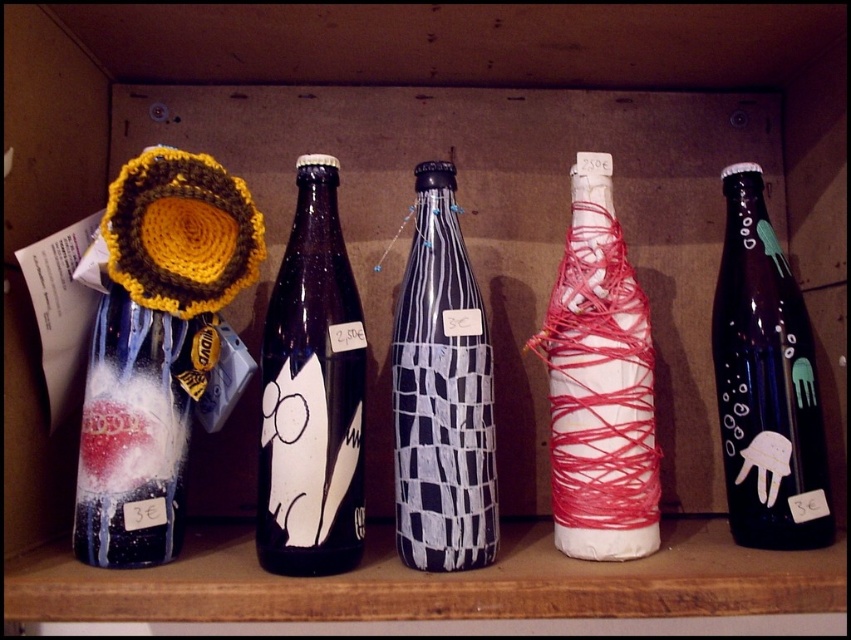
Consider the image. Is matte black bottle at center taller than matte black bottle at right?

Indeed, matte black bottle at center has a greater height compared to matte black bottle at right.

Does point (311, 198) lie behind point (780, 426)?

Yes, point (311, 198) is behind point (780, 426).

The width and height of the screenshot is (851, 640). In order to click on matte black bottle at center in this screenshot , I will do `click(312, 392)`.

Does point (735, 552) lie in front of point (564, 316)?

That is True.

Is point (212, 563) positioned after point (553, 426)?

That is False.

Identify the location of matte black bottles at center. (433, 582).

Does matte black bottles at center appear under matte black bottle at right?

Yes, matte black bottles at center is below matte black bottle at right.

Does point (657, 589) come closer to viewer compared to point (827, 493)?

Yes, it is in front of point (827, 493).

What do you see at coordinates (433, 582) in the screenshot? I see `matte black bottles at center` at bounding box center [433, 582].

Where is `matte black bottles at center`? This screenshot has width=851, height=640. matte black bottles at center is located at coordinates coord(433,582).